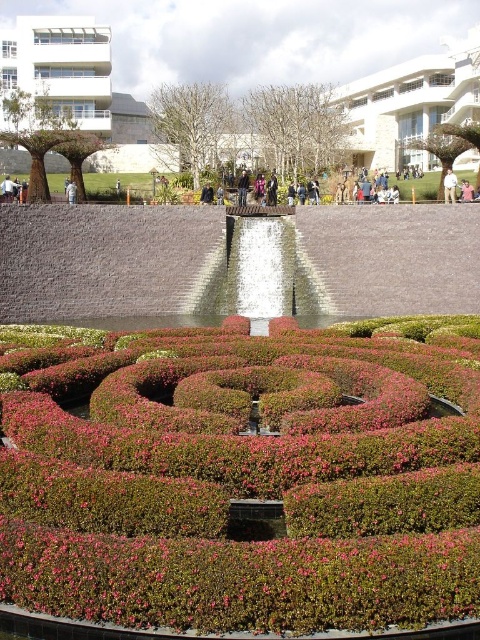
The height and width of the screenshot is (640, 480). Identify the location of light brown leather jacket at lower left. (10, 188).

The image size is (480, 640). Identify the location of light brown leather jacket at lower left. (10, 188).

Identify the location of light brown leather jacket at lower left. This screenshot has height=640, width=480. (10, 188).

Is dark blue jeans at center taller than brown leather jacket at center?

Yes, dark blue jeans at center is taller than brown leather jacket at center.

Can you confirm if dark blue jeans at center is smaller than brown leather jacket at center?

No, dark blue jeans at center is not smaller than brown leather jacket at center.

Locate an element on the screen. The image size is (480, 640). dark blue jeans at center is located at coordinates (260, 188).

Is green leafy hedge at center to the left of light brown leather jacket at lower left from the viewer's perspective?

No, green leafy hedge at center is not to the left of light brown leather jacket at lower left.

Can you confirm if green leafy hedge at center is bigger than light brown leather jacket at lower left?

Yes, green leafy hedge at center is bigger than light brown leather jacket at lower left.

Is point (309, 403) closer to camera compared to point (3, 184)?

That is True.

The width and height of the screenshot is (480, 640). I want to click on green leafy hedge at center, so click(241, 484).